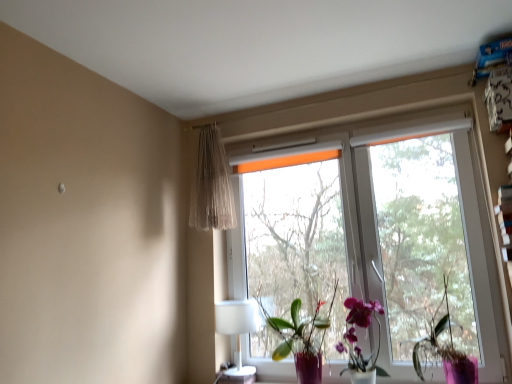
What do you see at coordinates (445, 348) in the screenshot? I see `purple matte plant at right, the first houseplant positioned from the right` at bounding box center [445, 348].

What is the approximate width of transparent glass window at center?

The width of transparent glass window at center is 14.46 centimeters.

Measure the distance between orange fabric tree at center and camera.

The distance of orange fabric tree at center from camera is 7.07 feet.

Find the location of a particular element. translucent beige curtain at upper left is located at coordinates (211, 184).

Find the location of a particular element. purple glossy orchid at center, arranged as the 2th houseplant when viewed from the right is located at coordinates (357, 341).

Does orange fabric tree at center come behind translucent beige curtain at upper left?

No, orange fabric tree at center is closer to the camera.

How different are the orientations of orange fabric tree at center and translucent beige curtain at upper left in degrees?

They differ by 1.72 degrees in their facing directions.

Is orange fabric tree at center inside the boundaries of translucent beige curtain at upper left, or outside?

orange fabric tree at center is located beyond the bounds of translucent beige curtain at upper left.

Is point (285, 200) closer or farther from the camera than point (199, 150)?

Point (285, 200).

From a real-world perspective, is purple glossy orchid at center, arranged as the 2th houseplant when viewed from the right, above or below translucent beige curtain at upper left?

purple glossy orchid at center, arranged as the 2th houseplant when viewed from the right, is situated lower than translucent beige curtain at upper left in the real world.

From the image's perspective, which is below, purple glossy orchid at center, arranged as the 2th houseplant when viewed from the right, or translucent beige curtain at upper left?

purple glossy orchid at center, arranged as the 2th houseplant when viewed from the right, from the image's perspective.

Identify the location of curtain above the purple glossy orchid at center, arranged as the 2th houseplant when viewed from the right (from the image's perspective). (211, 184).

Is purple glossy orchid at center, arranged as the 2th houseplant when viewed from the right, placed right next to translucent beige curtain at upper left?

No, purple glossy orchid at center, arranged as the 2th houseplant when viewed from the right, is not in contact with translucent beige curtain at upper left.

Is transparent glass window at center smaller than white plastic table lamp at lower center?

Actually, transparent glass window at center might be larger than white plastic table lamp at lower center.

Could white plastic table lamp at lower center be considered to be inside transparent glass window at center?

That's incorrect, white plastic table lamp at lower center is not inside transparent glass window at center.

From the image's perspective, which one is positioned lower, transparent glass window at center or white plastic table lamp at lower center?

From the image's view, white plastic table lamp at lower center is below.

Is transparent glass window at center positioned with its back to white plastic table lamp at lower center?

Absolutely, transparent glass window at center is directed away from white plastic table lamp at lower center.

In terms of width, does orange fabric tree at center look wider or thinner when compared to purple matte plant at right, the first houseplant positioned from the right?

Considering their sizes, orange fabric tree at center looks slimmer than purple matte plant at right, the first houseplant positioned from the right.

Would you say orange fabric tree at center is outside purple matte plant at right, the first houseplant positioned from the right?

Yes, orange fabric tree at center is outside of purple matte plant at right, the first houseplant positioned from the right.

Starting from the orange fabric tree at center, which houseplant is the 2nd one in front? Please provide its 2D coordinates.

[(445, 348)]

Is white plastic table lamp at lower center wider or thinner than purple glossy orchid at center, arranged as the 2th houseplant when viewed from the right?

white plastic table lamp at lower center is wider than purple glossy orchid at center, arranged as the 2th houseplant when viewed from the right.

Between point (251, 309) and point (355, 298), which one is positioned in front?

Point (355, 298)

Measure the distance between white plastic table lamp at lower center and purple glossy orchid at center, arranged as the 2th houseplant when viewed from the right.

23.60 inches.

From the image's perspective, is white plastic table lamp at lower center located above or below purple glossy orchid at center, arranged as the 2th houseplant when viewed from the right?

white plastic table lamp at lower center is situated lower than purple glossy orchid at center, arranged as the 2th houseplant when viewed from the right, in the image.

From the image's perspective, which one is positioned lower, orange fabric tree at center or white plastic table lamp at lower center?

white plastic table lamp at lower center, from the image's perspective.

Does orange fabric tree at center have a smaller size compared to white plastic table lamp at lower center?

No.

Do you think orange fabric tree at center is within white plastic table lamp at lower center, or outside of it?

orange fabric tree at center is outside white plastic table lamp at lower center.

How many degrees apart are the facing directions of orange fabric tree at center and white plastic table lamp at lower center?

The angle between the facing direction of orange fabric tree at center and the facing direction of white plastic table lamp at lower center is 1.49 degrees.

The width and height of the screenshot is (512, 384). Identify the location of floral arrangement on the left of purple glossy orchid at center, arranged as the 2th houseplant when viewed from the right. (301, 337).

Is purple glossy orchid at center, which ranks as the 1th houseplant in left-to-right order, inside translucent glass vase with orchids at center?

No, purple glossy orchid at center, which ranks as the 1th houseplant in left-to-right order, is not surrounded by translucent glass vase with orchids at center.

From a real-world perspective, which is physically above, translucent glass vase with orchids at center or purple glossy orchid at center, arranged as the 2th houseplant when viewed from the right?

In real-world perspective, translucent glass vase with orchids at center is above.

From the picture: Is translucent glass vase with orchids at center looking in the opposite direction of purple glossy orchid at center, arranged as the 2th houseplant when viewed from the right?

No, translucent glass vase with orchids at center's orientation is not away from purple glossy orchid at center, arranged as the 2th houseplant when viewed from the right.

Find the location of `curtain above the orange fabric tree at center (from a real-world perspective)`. curtain above the orange fabric tree at center (from a real-world perspective) is located at coordinates (211, 184).

In order to click on curtain on the left of purple glossy orchid at center, which ranks as the 1th houseplant in left-to-right order in this screenshot , I will do `click(211, 184)`.

From the picture: Which object lies nearer to the anchor point translucent beige curtain at upper left, orange fabric tree at center or purple matte plant at right, the first houseplant positioned from the right?

orange fabric tree at center lies closer to translucent beige curtain at upper left than the other object.

From the image, which object appears to be farther from white plastic table lamp at lower center, translucent glass vase with orchids at center or orange fabric tree at center?

orange fabric tree at center lies further to white plastic table lamp at lower center than the other object.

In the scene shown: When comparing their distances from translucent glass vase with orchids at center, does purple glossy orchid at center, which ranks as the 1th houseplant in left-to-right order, or orange fabric tree at center seem closer?

purple glossy orchid at center, which ranks as the 1th houseplant in left-to-right order, lies closer to translucent glass vase with orchids at center than the other object.

From the image, which object appears to be farther from purple matte plant at right, the first houseplant positioned from the right, transparent glass window at center or translucent glass vase with orchids at center?

transparent glass window at center lies further to purple matte plant at right, the first houseplant positioned from the right, than the other object.

Estimate the real-world distances between objects in this image. Which object is closer to purple matte plant at right, the first houseplant positioned from the right, translucent beige curtain at upper left or orange fabric tree at center?

Among the two, orange fabric tree at center is located nearer to purple matte plant at right, the first houseplant positioned from the right.

Based on their spatial positions, is white plastic table lamp at lower center or translucent beige curtain at upper left closer to purple glossy orchid at center, which ranks as the 1th houseplant in left-to-right order?

Among the two, white plastic table lamp at lower center is located nearer to purple glossy orchid at center, which ranks as the 1th houseplant in left-to-right order.

Considering their positions, is orange fabric tree at center positioned further to translucent glass vase with orchids at center than purple matte plant at right, the first houseplant positioned from the right?

orange fabric tree at center is further to translucent glass vase with orchids at center.

Considering their positions, is purple glossy orchid at center, arranged as the 2th houseplant when viewed from the right, positioned closer to orange fabric tree at center than translucent glass vase with orchids at center?

Based on the image, translucent glass vase with orchids at center appears to be nearer to orange fabric tree at center.

Locate an element on the screen. Image resolution: width=512 pixels, height=384 pixels. tree situated between translucent glass vase with orchids at center and purple matte plant at right, the first houseplant positioned from the right, from left to right is located at coordinates (297, 241).

At what (x,y) coordinates should I click in order to perform the action: click on floral arrangement located between white plastic table lamp at lower center and transparent glass window at center in the left-right direction. Please return your answer as a coordinate pair (x, y). The width and height of the screenshot is (512, 384). Looking at the image, I should click on (301, 337).

The height and width of the screenshot is (384, 512). In order to click on floral arrangement between translucent beige curtain at upper left and purple matte plant at right, the first houseplant positioned from the right, in the horizontal direction in this screenshot , I will do `click(301, 337)`.

Identify the location of tree between translucent beige curtain at upper left and transparent glass window at center in the horizontal direction. The height and width of the screenshot is (384, 512). (297, 241).